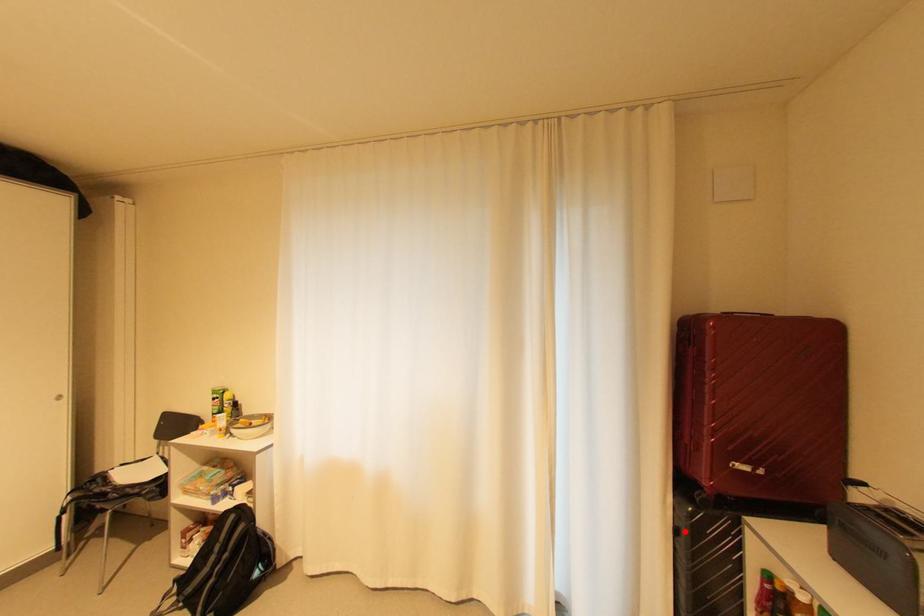
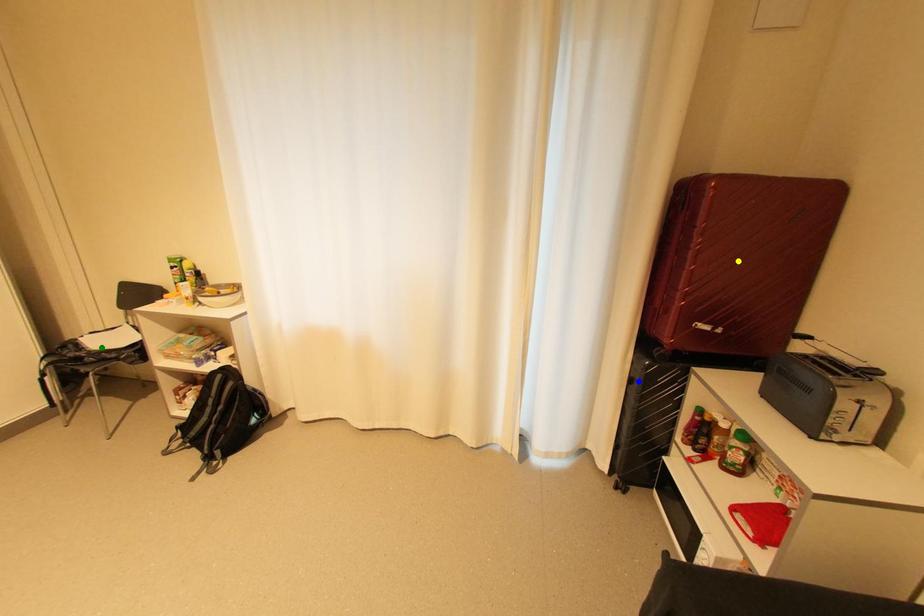
Question: I am providing you with two images of the same scene from different viewpoints. A red point is marked on the first image. You are given multiple points on the second image. Which point in image 2 represents the same 3d spot as the red point in image 1?

Choices:
 (A) yellow point
 (B) blue point
 (C) green point

Answer: (B)